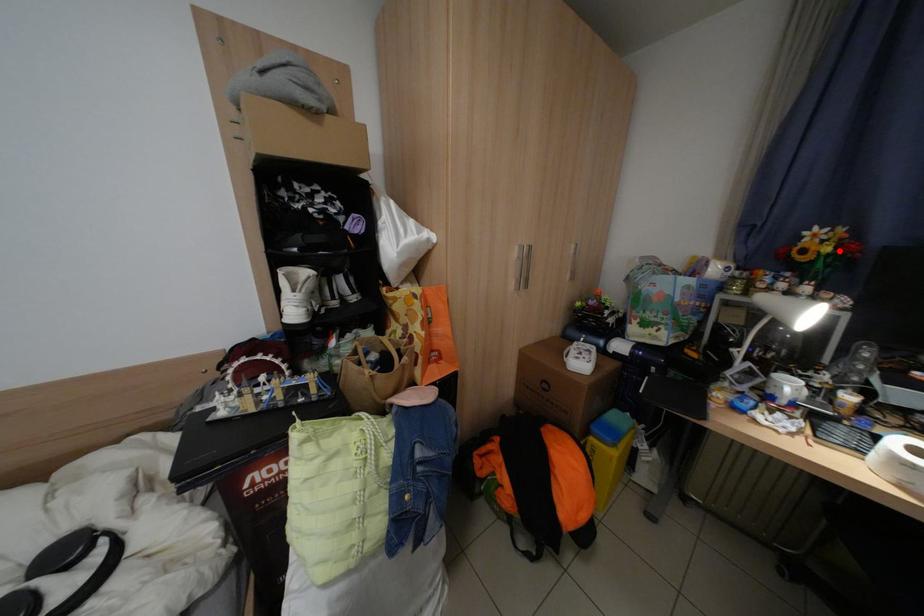
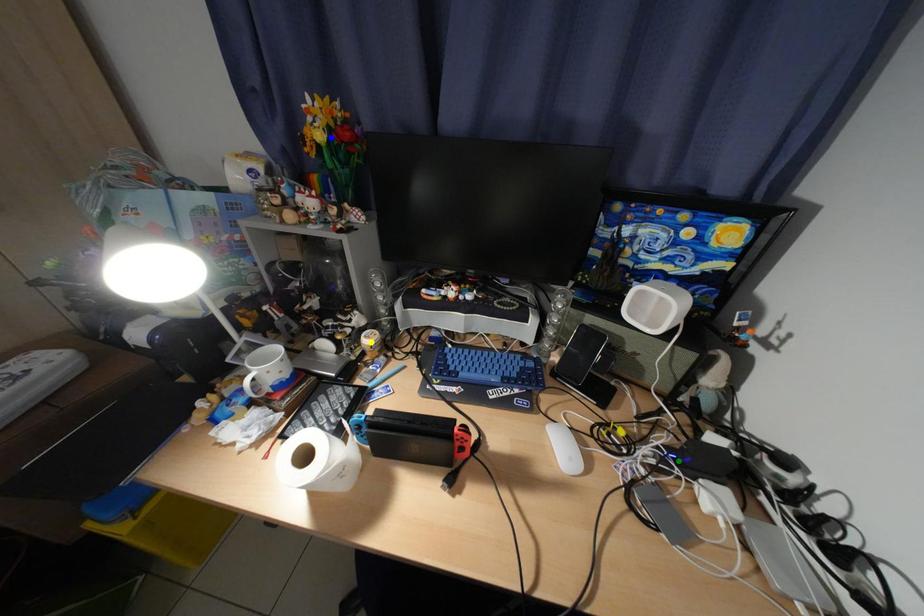
Question: I am providing you with two images of the same scene from different viewpoints. A red point is marked on the first image. You are given multiple points on the second image. Which point in image 2 is actually the same real-world point as the red point in image 1?

Choices:
 (A) blue point
 (B) green point
 (C) yellow point

Answer: (A)